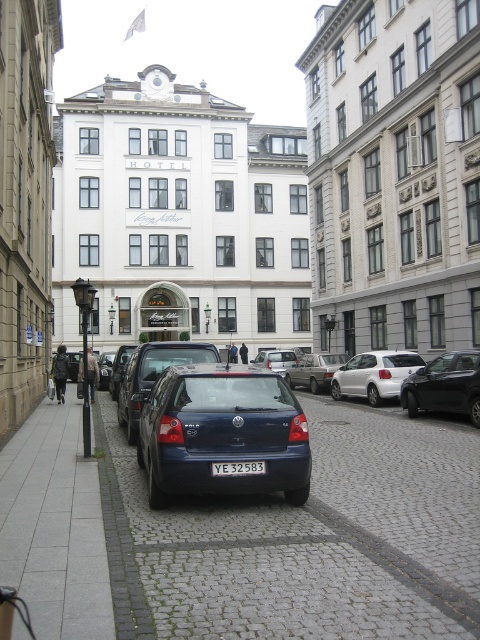
Does shiny black sedan at right appear on the right side of blue matte car at center?

Correct, you'll find shiny black sedan at right to the right of blue matte car at center.

Which is in front, point (470, 362) or point (146, 371)?

Point (146, 371) is more forward.

Where is `shiny black sedan at right`? shiny black sedan at right is located at coordinates (444, 385).

Does gray concrete sidewalk at lower left come behind yellow metallic license plate at center?

No.

Does gray concrete sidewalk at lower left come in front of yellow metallic license plate at center?

Yes.

Identify the location of gray concrete sidewalk at lower left. This screenshot has width=480, height=640. pyautogui.click(x=55, y=525).

At what (x,y) coordinates should I click in order to perform the action: click on gray concrete sidewalk at lower left. Please return your answer as a coordinate pair (x, y). Looking at the image, I should click on (55, 525).

From the picture: Who is taller, matte blue hatchback at center or yellow metallic license plate at center?

Standing taller between the two is matte blue hatchback at center.

Which is in front, point (245, 432) or point (252, 468)?

Point (252, 468) is more forward.

What are the coordinates of `matte blue hatchback at center` in the screenshot? It's located at (222, 433).